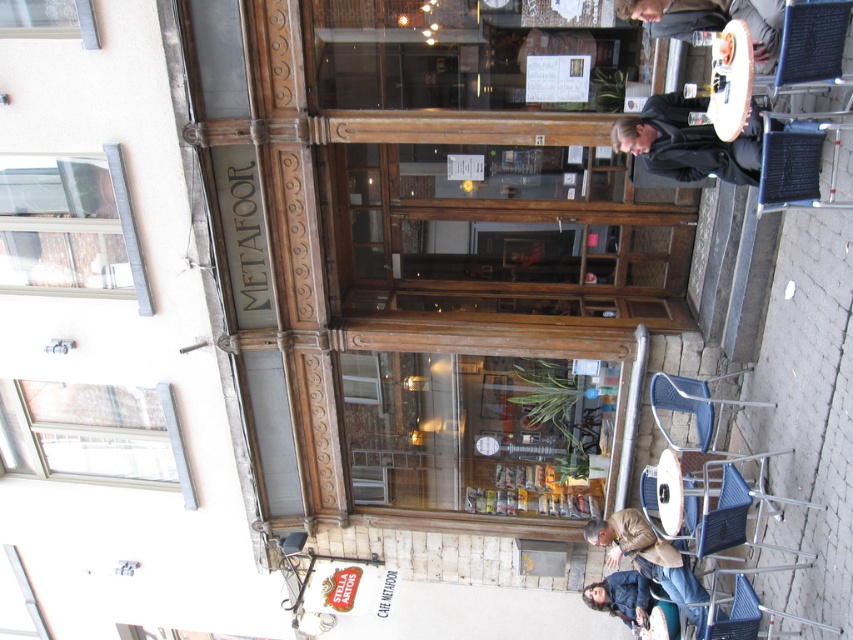
Question: Which object is positioned closest to the white plastic window at upper left?

Choices:
 (A) dark blue jacket at lower right
 (B) leather jacket at lower right
 (C) clear glass window at upper left

Answer: (C)

Question: Does white plastic window at upper left have a smaller size compared to black leather jacket at upper right?

Choices:
 (A) no
 (B) yes

Answer: (A)

Question: Is the position of white plastic window at upper left less distant than that of dark brown leather jacket at upper right?

Choices:
 (A) no
 (B) yes

Answer: (A)

Question: Based on their relative distances, which object is farther from the leather jacket at lower right?

Choices:
 (A) transparent glass window at upper left
 (B) dark blue jacket at lower right
 (C) dark brown leather jacket at upper right
 (D) black leather jacket at upper right

Answer: (A)

Question: Does black leather jacket at upper right have a greater width compared to dark brown leather jacket at upper right?

Choices:
 (A) yes
 (B) no

Answer: (A)

Question: Which object is farther from the camera taking this photo?

Choices:
 (A) transparent glass window at upper left
 (B) leather jacket at lower right

Answer: (A)